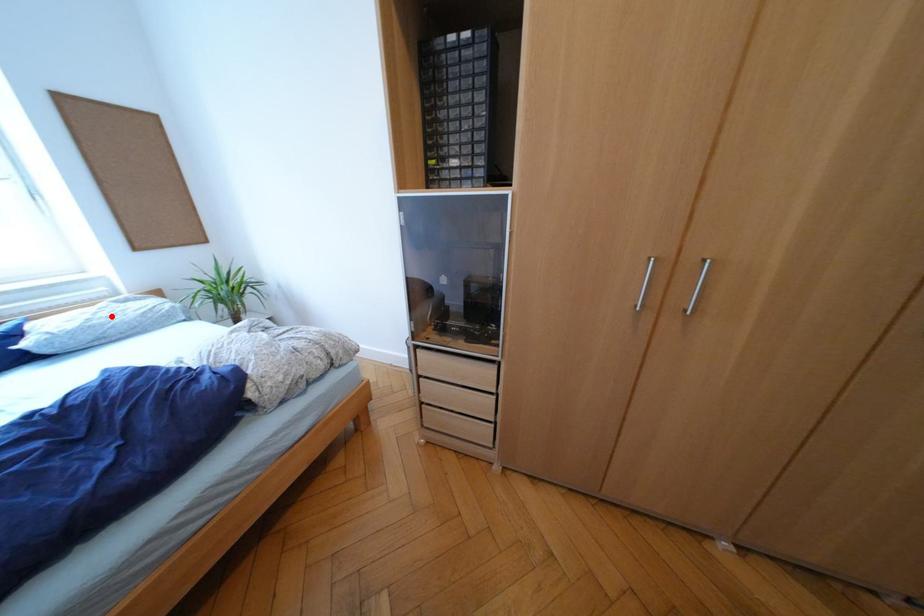
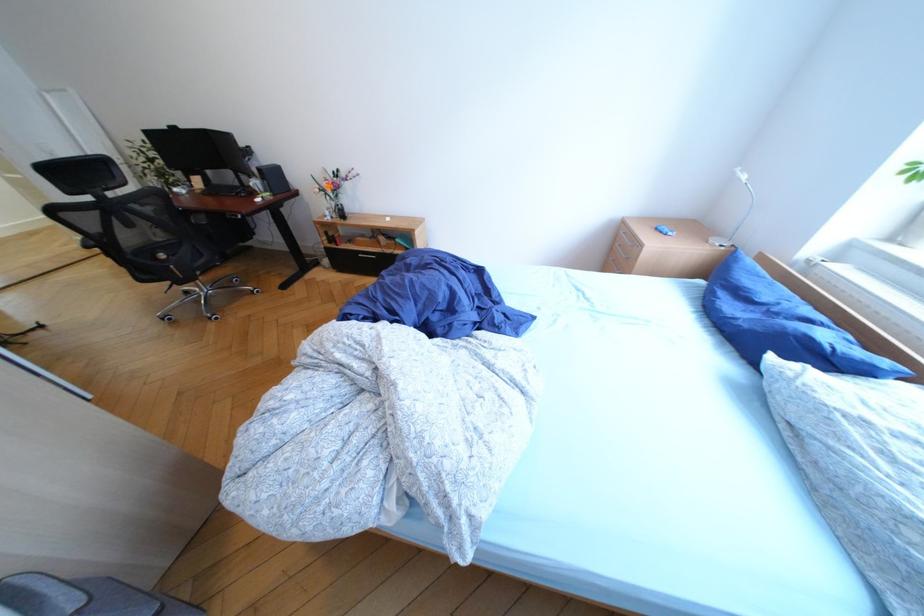
Find the pixel in the second image that matches the highlighted location in the first image.

(912, 448)